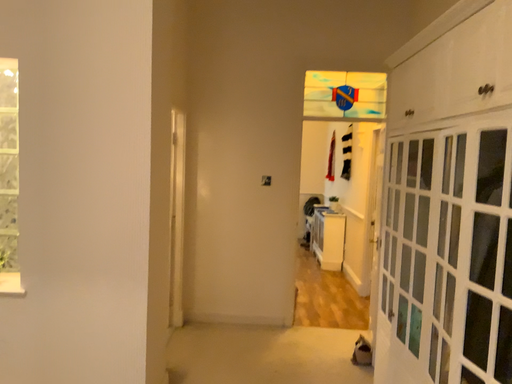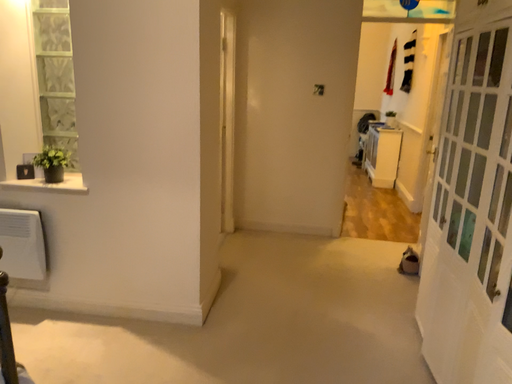
Question: Which way did the camera rotate in the video?

Choices:
 (A) rotated upward
 (B) rotated downward

Answer: (B)